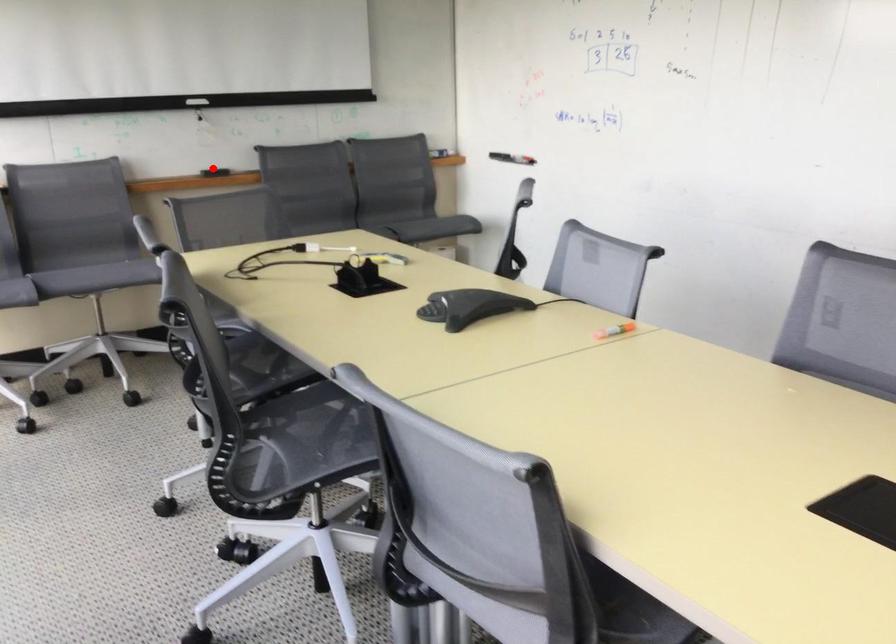
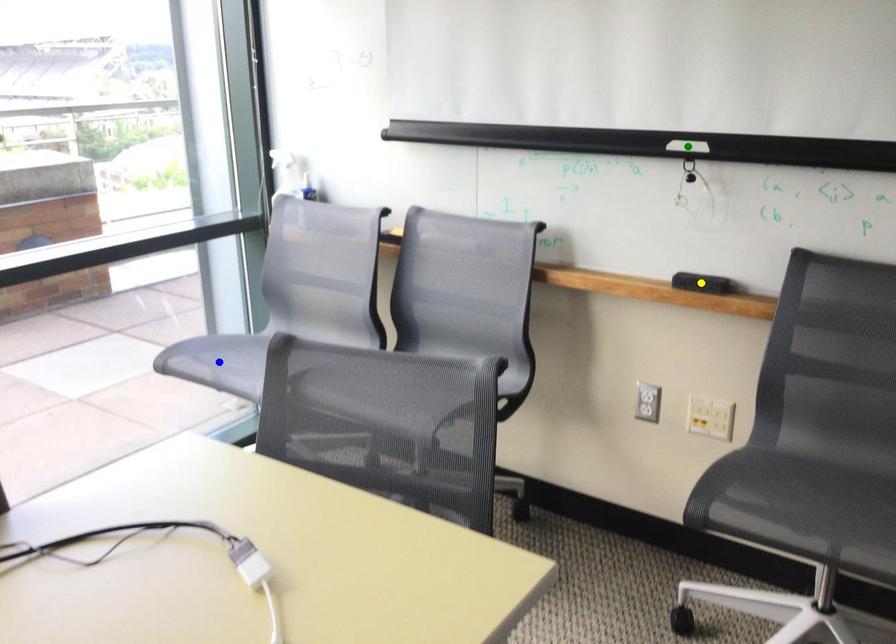
Question: I am providing you with two images of the same scene from different viewpoints. A red point is marked on the first image. You are given multiple points on the second image. Which spot in image 2 lines up with the point in image 1?

Choices:
 (A) blue point
 (B) green point
 (C) yellow point

Answer: (C)